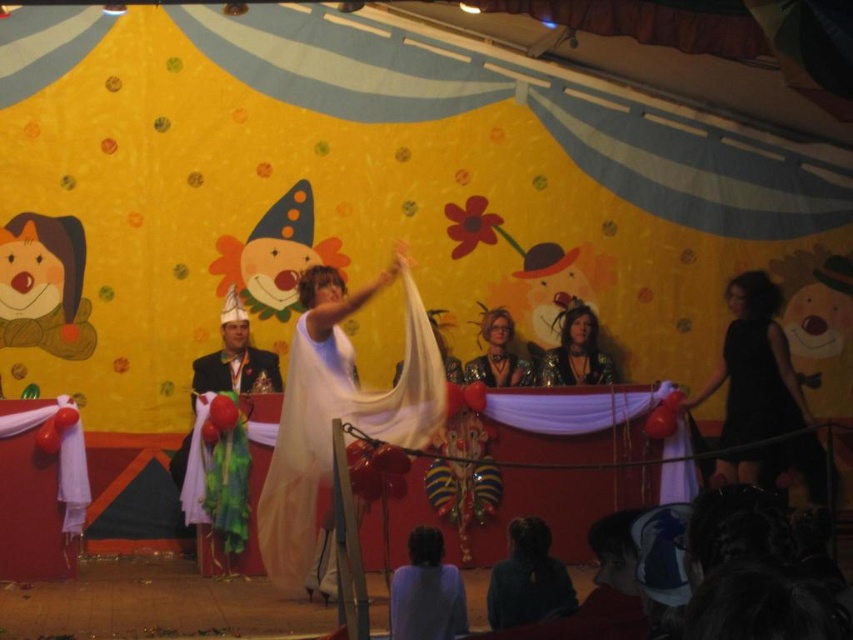
Question: Which object appears closest to the camera in this image?

Choices:
 (A) shiny silver hat at left
 (B) dark fabric at lower center
 (C) shiny metallic necklace at center

Answer: (B)

Question: Can you confirm if dark fabric at lower center is thinner than shiny silver hat at left?

Choices:
 (A) yes
 (B) no

Answer: (A)

Question: Which point is farther from the camera taking this photo?

Choices:
 (A) (741, 323)
 (B) (556, 314)

Answer: (B)

Question: Is shiny silver hat at left wider than shiny metallic necklace at center?

Choices:
 (A) yes
 (B) no

Answer: (A)

Question: Which object is farther from the camera taking this photo?

Choices:
 (A) shiny silver hat at left
 (B) dark fabric at lower center
 (C) shiny metallic necklace at center
 (D) black satin dress at right

Answer: (C)

Question: Is black satin dress at right thinner than shiny silver hat at left?

Choices:
 (A) no
 (B) yes

Answer: (A)